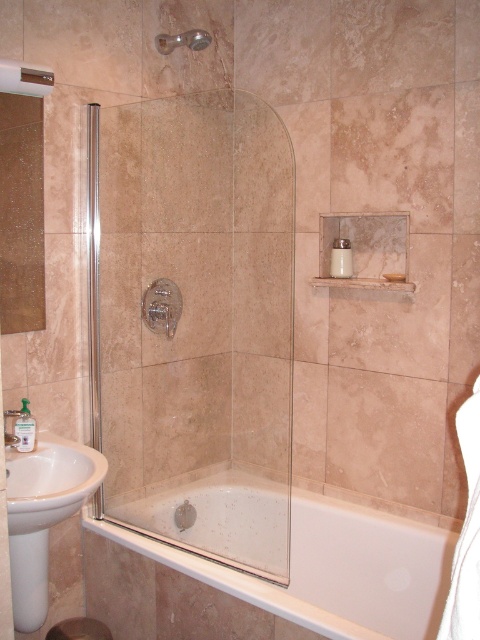
Question: Is white glossy bathtub at lower center wider than matte silver showerhead at upper center?

Choices:
 (A) no
 (B) yes

Answer: (B)

Question: Does clear glass shower door at center have a smaller size compared to brushed metal faucet at lower left?

Choices:
 (A) no
 (B) yes

Answer: (A)

Question: Which of these objects is positioned closest to the matte silver showerhead at upper center?

Choices:
 (A) clear glass shower door at center
 (B) clear glass shower door at left
 (C) white glossy bathtub at lower center
 (D) brushed metal faucet at lower left

Answer: (B)

Question: Which point is closer to the camera taking this photo?

Choices:
 (A) (108, 524)
 (B) (14, 422)
 (C) (245, 417)

Answer: (B)

Question: Which of the following is the closest to the observer?

Choices:
 (A) clear glass shower door at center
 (B) matte silver showerhead at upper center
 (C) white ceramic sink at lower left
 (D) clear glass shower door at left

Answer: (C)

Question: Does clear glass shower door at left have a lesser width compared to matte silver showerhead at upper center?

Choices:
 (A) no
 (B) yes

Answer: (B)